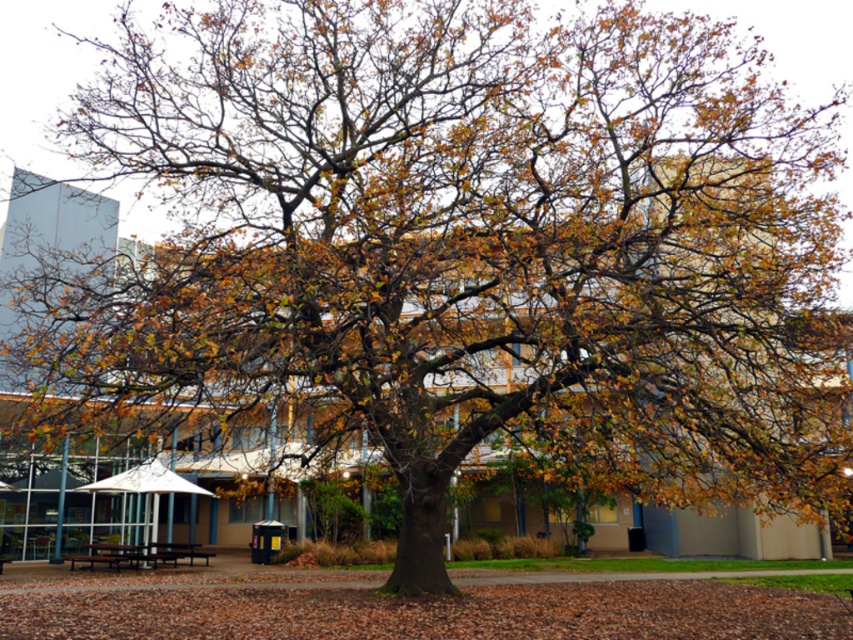
Question: Which object is farther from the camera taking this photo?

Choices:
 (A) dark brown wooden bench at center
 (B) brown wooden picnic table at lower left
 (C) wooden park bench at lower left

Answer: (A)

Question: Is brown wooden picnic table at lower left closer to the viewer compared to dark brown wooden bench at center?

Choices:
 (A) yes
 (B) no

Answer: (A)

Question: Which point is farther to the camera?

Choices:
 (A) (199, 552)
 (B) (114, 563)
 (C) (108, 548)

Answer: (A)

Question: In this image, where is brown wooden picnic table at lower left located relative to dark brown wooden bench at center?

Choices:
 (A) above
 (B) below

Answer: (A)

Question: Which object is positioned closest to the brown wooden picnic table at lower left?

Choices:
 (A) dark brown wooden bench at center
 (B) wooden park bench at lower left

Answer: (B)

Question: Is brown wooden picnic table at lower left wider than dark brown wooden bench at center?

Choices:
 (A) yes
 (B) no

Answer: (A)